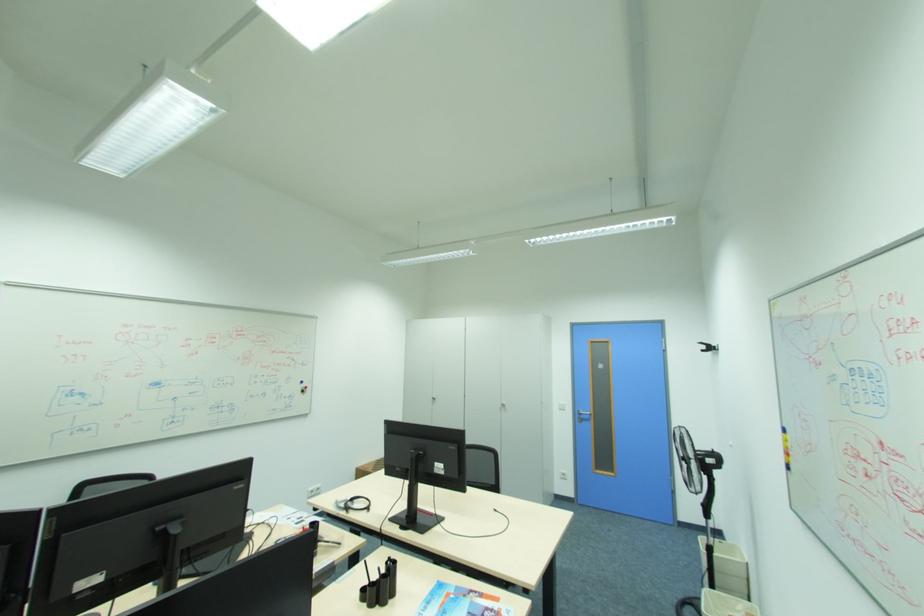
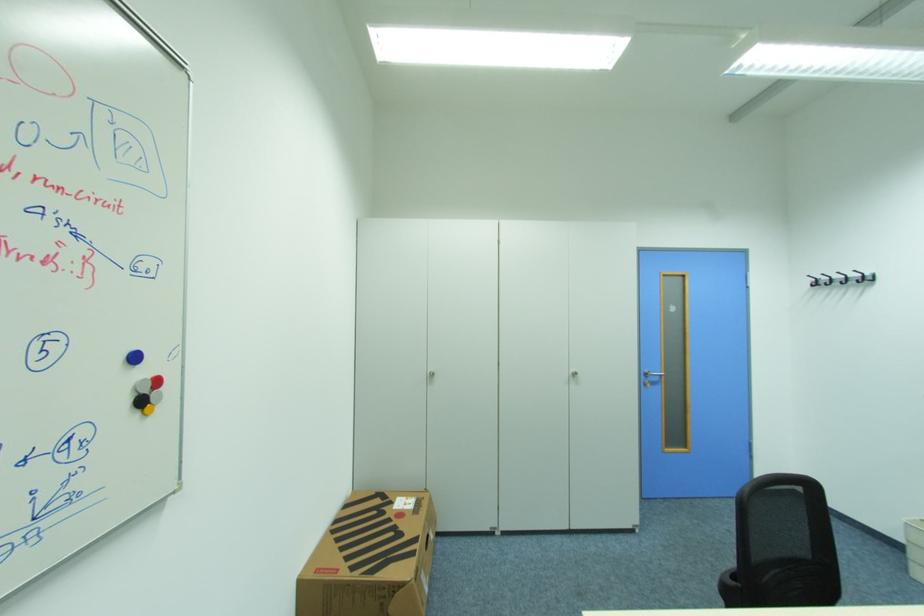
The point at (307, 382) is marked in the first image. Where is the corresponding point in the second image?

(140, 359)